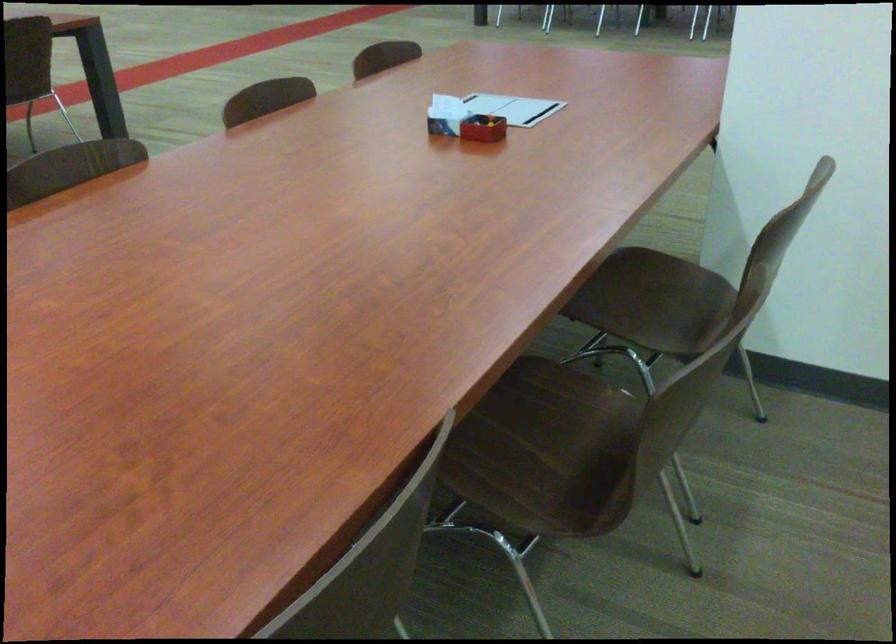
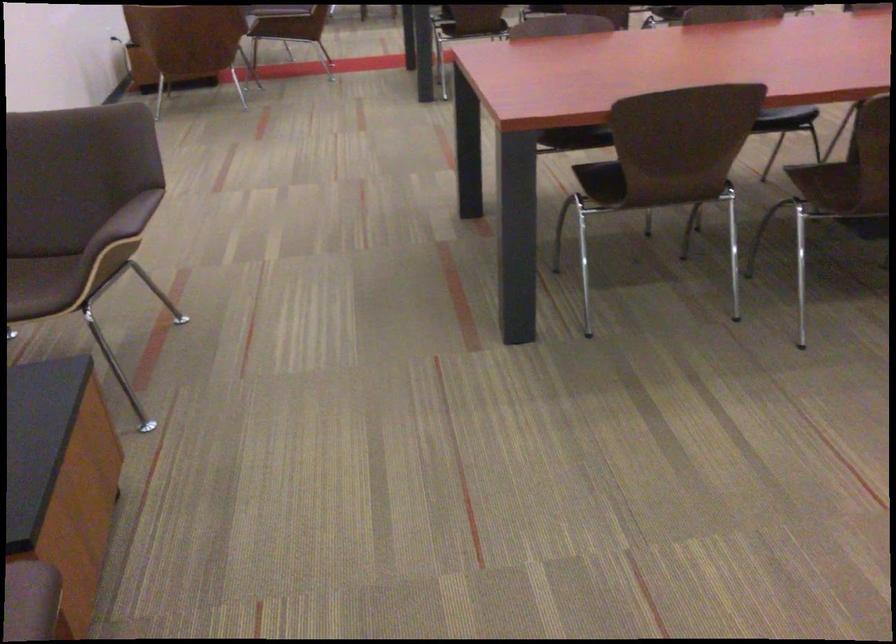
Find the pixel in the second image that matches point (493, 486) in the first image.

(819, 183)